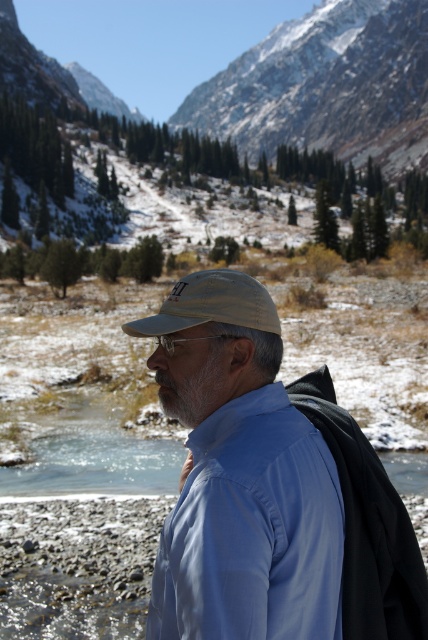
Question: Is blue smooth shirt at center below snowy granite mountain at upper center?

Choices:
 (A) yes
 (B) no

Answer: (A)

Question: Which point is closer to the camera?

Choices:
 (A) snowy granite mountain at upper center
 (B) blue smooth shirt at center
 (C) snowy rocky mountain at upper center

Answer: (B)

Question: Can you confirm if snowy granite mountain at upper center is bigger than black fabric at right?

Choices:
 (A) yes
 (B) no

Answer: (A)

Question: Which point appears closest to the camera in this image?

Choices:
 (A) click(217, 522)
 (B) click(237, 93)

Answer: (A)

Question: Is blue smooth shirt at center further to the viewer compared to black fabric at right?

Choices:
 (A) no
 (B) yes

Answer: (A)

Question: Which point is farther to the camera?

Choices:
 (A) pyautogui.click(x=342, y=454)
 (B) pyautogui.click(x=278, y=35)
 (C) pyautogui.click(x=270, y=609)
 (D) pyautogui.click(x=2, y=26)

Answer: (B)